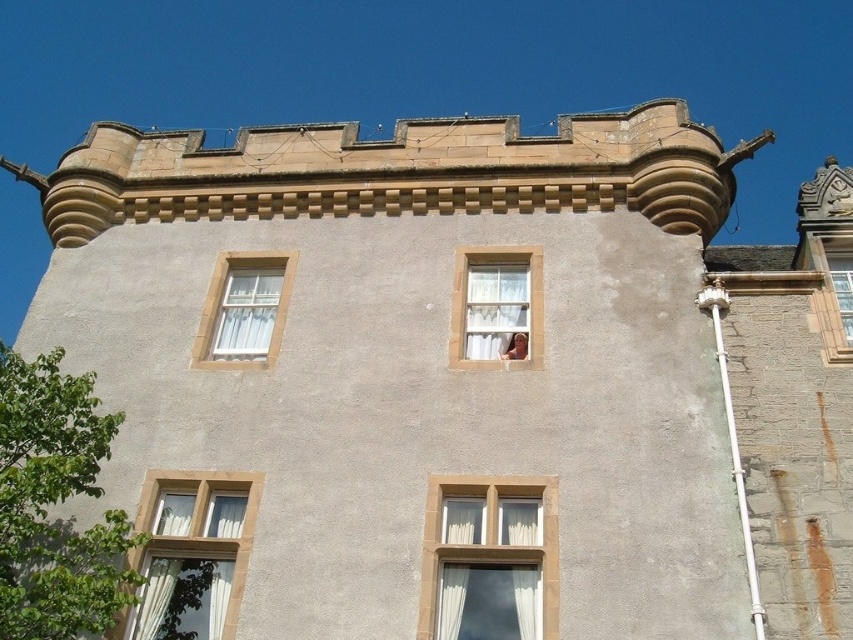
Question: Among these objects, which one is nearest to the camera?

Choices:
 (A) white sheer curtain at upper left
 (B) wooden window frame at upper right

Answer: (B)

Question: Which of the following is the closest to the observer?

Choices:
 (A) white textured curtain at center
 (B) white textured window at lower left
 (C) white sheer curtain at upper left

Answer: (B)

Question: Which of the following is the closest to the observer?

Choices:
 (A) white textured window at lower left
 (B) white textured curtain at center

Answer: (A)

Question: Is white textured window at lower left smaller than white sheer curtain at upper left?

Choices:
 (A) yes
 (B) no

Answer: (B)

Question: Is white sheer curtain at upper left closer to the viewer compared to wooden window frame at upper right?

Choices:
 (A) no
 (B) yes

Answer: (A)

Question: Does white textured curtain at center appear over white textured window at center?

Choices:
 (A) yes
 (B) no

Answer: (A)